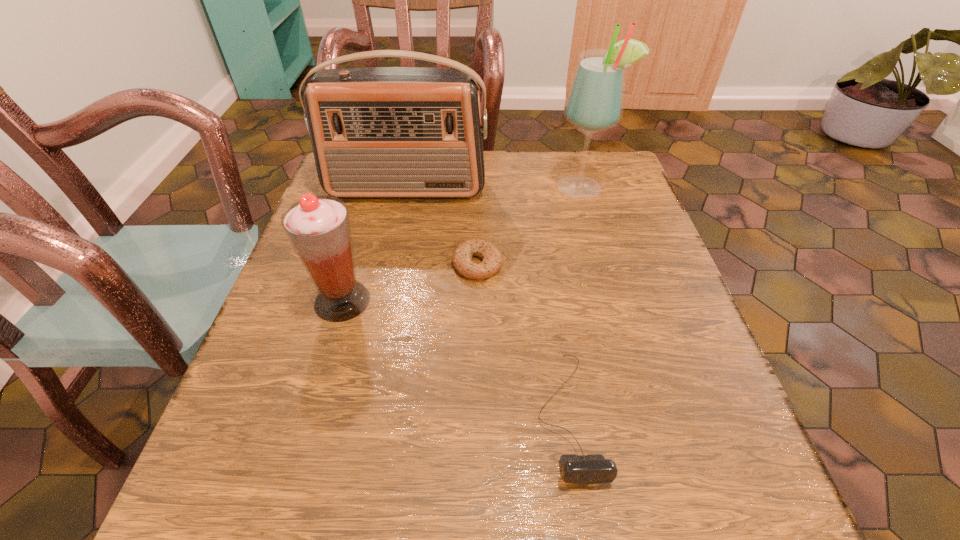
Where is `vacant area at the left edge of the desktop`? This screenshot has height=540, width=960. vacant area at the left edge of the desktop is located at coordinates (372, 230).

Where is `free space at the right edge`? This screenshot has width=960, height=540. free space at the right edge is located at coordinates (618, 225).

In the image, there is a desktop. Where is `blank space at the near left corner`? This screenshot has width=960, height=540. blank space at the near left corner is located at coordinates (271, 535).

In the image, there is a desktop. Identify the location of free space at the far right corner. This screenshot has width=960, height=540. [x=575, y=152].

Locate an element on the screen. vacant space at the near right corner is located at coordinates (747, 505).

Locate an element on the screen. Image resolution: width=960 pixels, height=540 pixels. free space between the second tallest object and the third tallest object is located at coordinates (374, 245).

You are a GUI agent. You are given a task and a screenshot of the screen. Output one action in this format:
    pyautogui.click(x=<x>, y=<y>)
    Task: Click on the unoccupied position between the smoothie and the nearest object
    The height and width of the screenshot is (540, 960).
    Given the screenshot: What is the action you would take?
    pyautogui.click(x=455, y=358)

The height and width of the screenshot is (540, 960). In order to click on free space between the rightmost object and the fourth object from left to right in this screenshot , I will do `click(575, 301)`.

The width and height of the screenshot is (960, 540). Find the location of `vacant area that lies between the radio receiver and the second shortest object`. vacant area that lies between the radio receiver and the second shortest object is located at coordinates (487, 302).

This screenshot has height=540, width=960. Identify the location of free space between the rightmost object and the fourth tallest object. (575, 301).